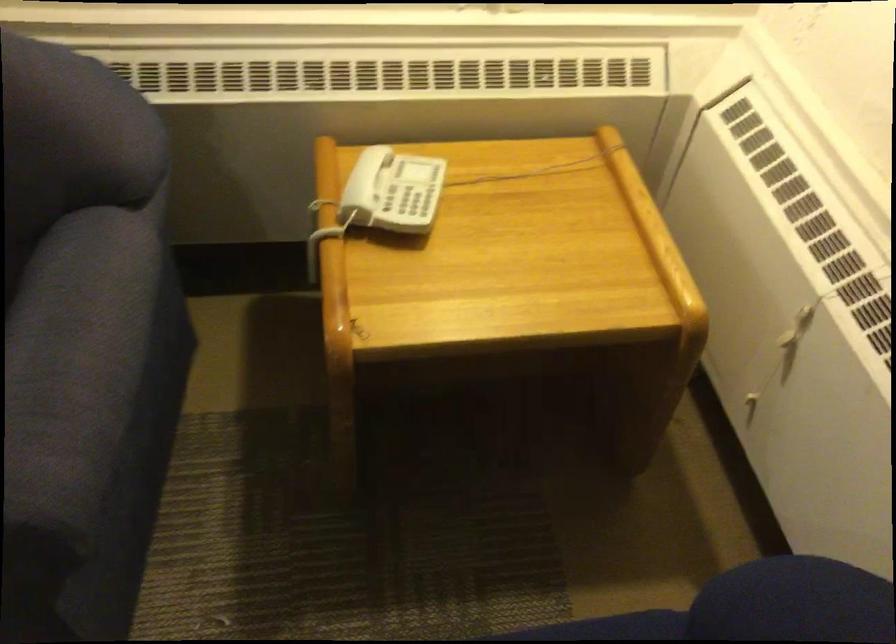
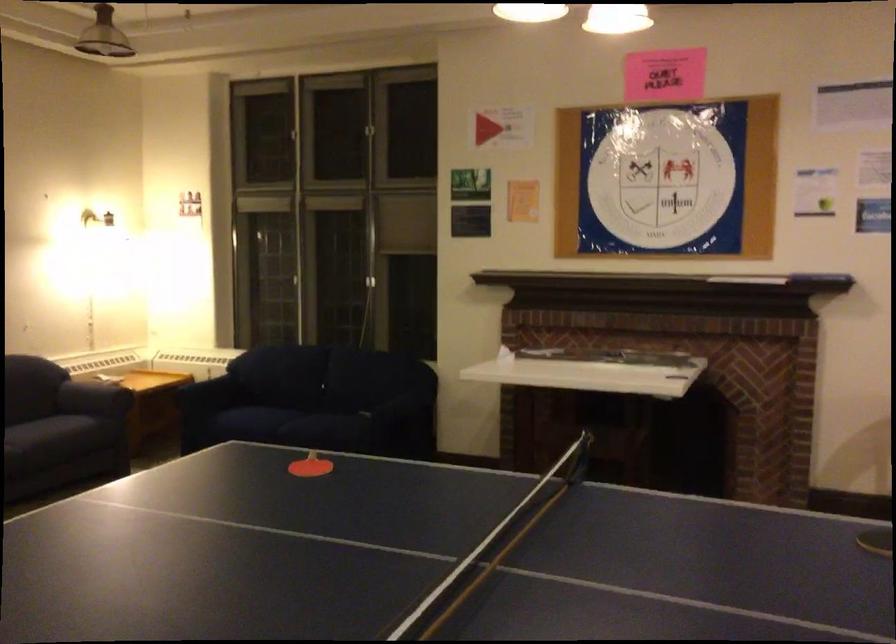
Question: I am providing you with two images of the same scene from different viewpoints. Which of the following objects are not visible in image2?

Choices:
 (A) red ping pong paddle
 (B) barbell shaft
 (C) silver window handle
 (D) blue sofa sitting surface

Answer: (D)